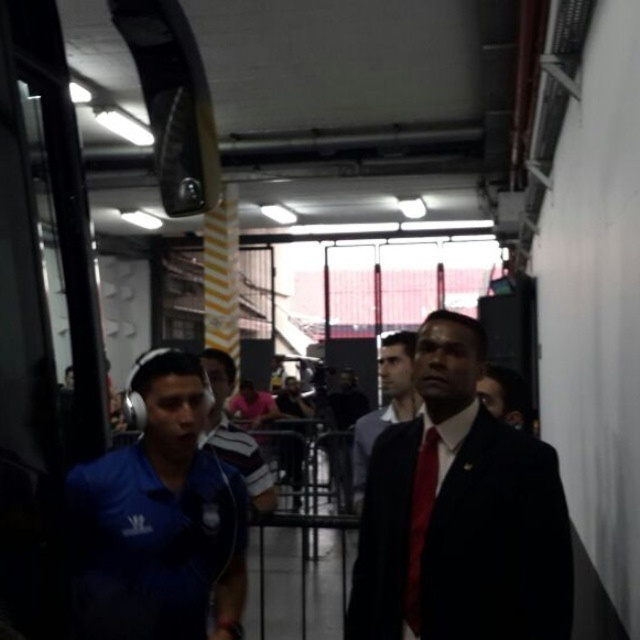
Question: Which object is positioned farthest from the striped fabric shirt at center?

Choices:
 (A) dark suit at center
 (B) blue fabric shirt at left

Answer: (A)

Question: Is blue fabric shirt at left to the right of red silk tie at center from the viewer's perspective?

Choices:
 (A) no
 (B) yes

Answer: (A)

Question: Which of the following is the closest to the observer?

Choices:
 (A) (68, 522)
 (B) (200, 442)
 (C) (536, 579)

Answer: (A)

Question: From the image, what is the correct spatial relationship of blue fabric shirt at left in relation to red silk tie at center?

Choices:
 (A) left
 (B) right

Answer: (A)

Question: Which of these objects is positioned farthest from the red silk tie at center?

Choices:
 (A) dark blue suit at center
 (B) blue fabric shirt at left
 (C) dark suit at center

Answer: (A)

Question: Does blue fabric shirt at left have a smaller size compared to red silk tie at center?

Choices:
 (A) no
 (B) yes

Answer: (A)